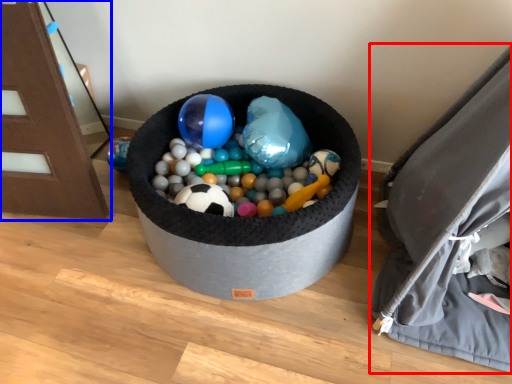
Question: Which of the following is the closest to the observer, bean bag chair (highlighted by a red box) or furniture (highlighted by a blue box)?

Choices:
 (A) bean bag chair
 (B) furniture

Answer: (A)